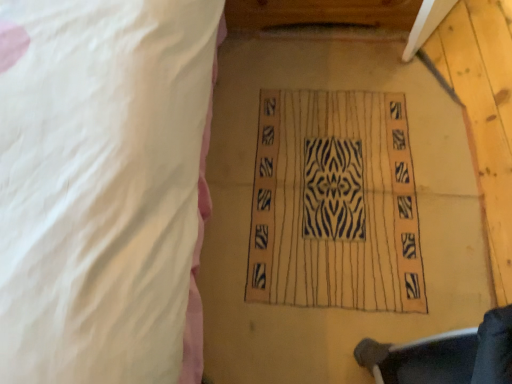
In order to click on free space above zebra-patterned fabric at center (from a real-world perspective) in this screenshot , I will do `click(325, 187)`.